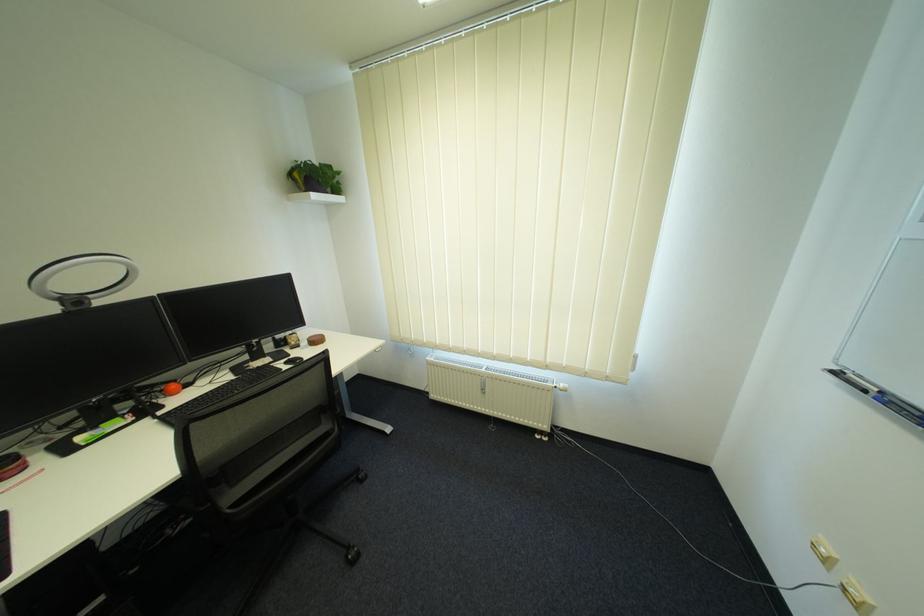
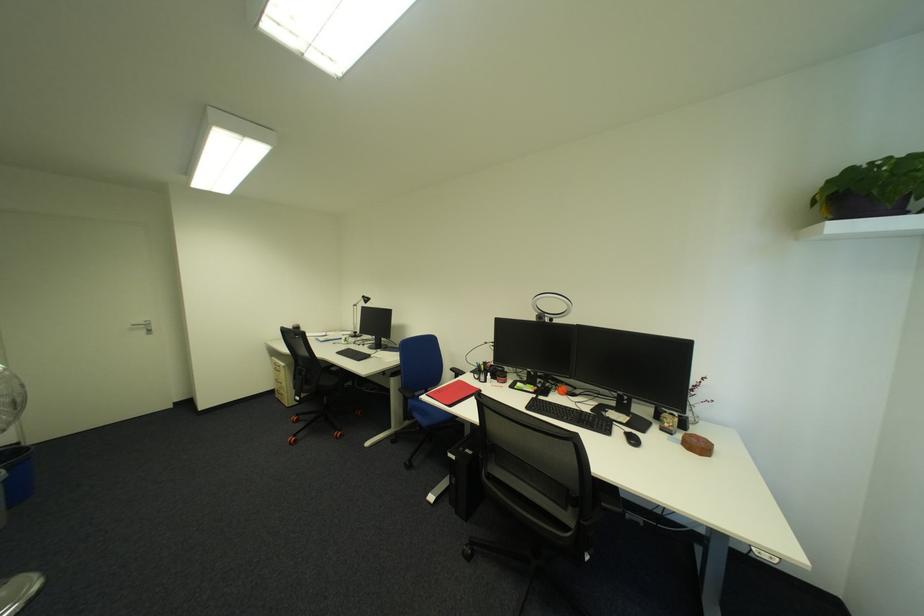
The point at (x=310, y=177) is marked in the first image. Where is the corresponding point in the second image?

(831, 200)